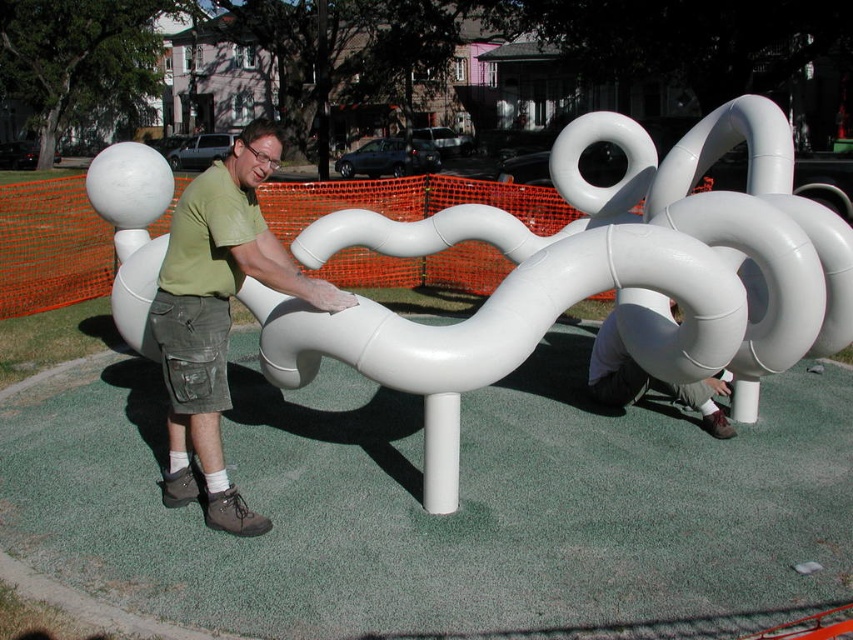
Question: Which object is closer to the camera taking this photo?

Choices:
 (A) green matte shirt at center
 (B) white matte tube at lower center

Answer: (A)

Question: Does green matte shirt at center appear on the right side of white matte tube at lower center?

Choices:
 (A) no
 (B) yes

Answer: (A)

Question: Observing the image, what is the correct spatial positioning of green matte shirt at center in reference to white matte tube at lower center?

Choices:
 (A) above
 (B) below

Answer: (A)

Question: In this image, where is green matte shirt at center located relative to white matte tube at lower center?

Choices:
 (A) below
 (B) above

Answer: (B)